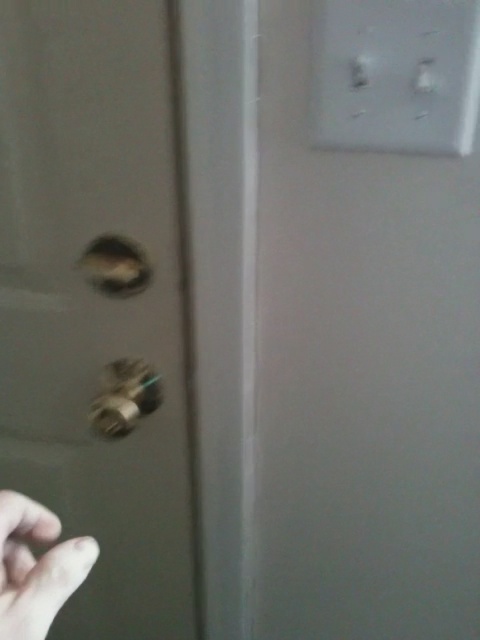
From the picture: You are trying to locate the door handle on the door. The door handle is part of the matte gold door handle at left. There is a point at coordinates point (96, 305). Is this point on the door handle?

Yes, the point (96, 305) is on the matte gold door handle at left.

You are trying to open the door shown in the scene. You notice there is a skinny white hand at lower left and a metallic gold door handle at left. Which object is narrower in width?

The skinny white hand at lower left is narrower in width compared to the metallic gold door handle at left.

You are trying to open the door in the image. The door handle is located at a specific coordinate. Can you tell me the exact coordinates of the matte gold door handle at left?

The matte gold door handle at left is located at point (96, 305).